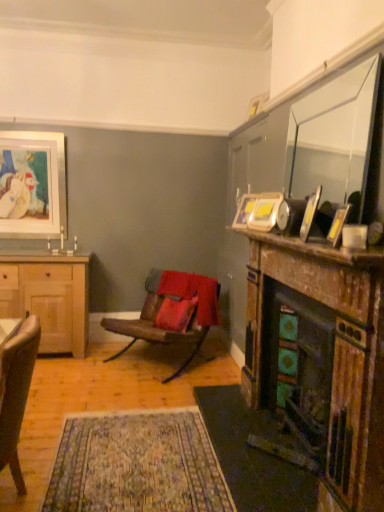
Identify the location of empty space that is ontop of matte white picture frame at upper left, the 1th picture frame when ordered from left to right (from a real-world perspective). The image size is (384, 512). (29, 134).